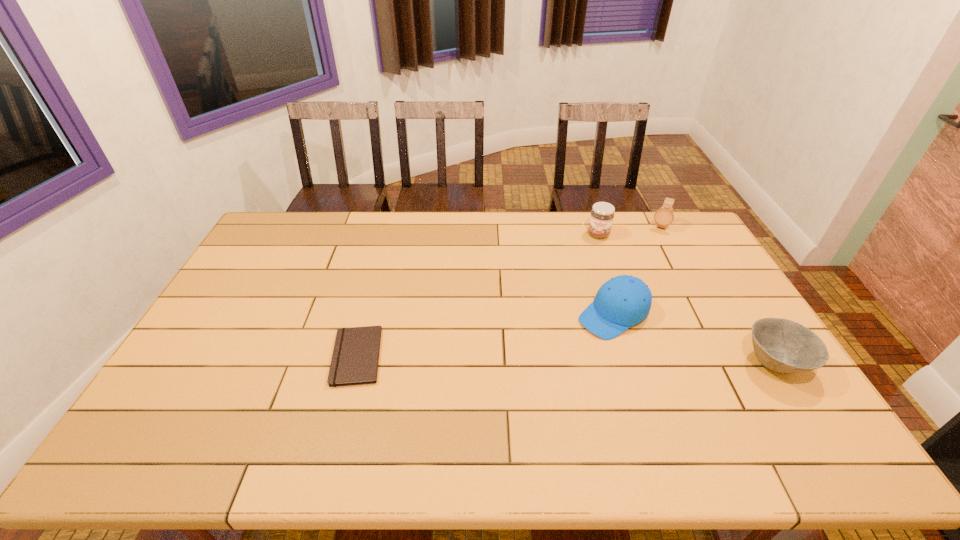
Select which object is the third closest to the bowl. Please provide its 2D coordinates. Your answer should be formatted as a tuple, i.e. [(x, y)], where the tuple contains the x and y coordinates of a point satisfying the conditions above.

[(602, 214)]

At what (x,y) coordinates should I click in order to perform the action: click on free location that satisfies the following two spatial constraints: 1. on the back side of the watch; 2. on the left side of the checkbook. Please return your answer as a coordinate pair (x, y). Looking at the image, I should click on (392, 226).